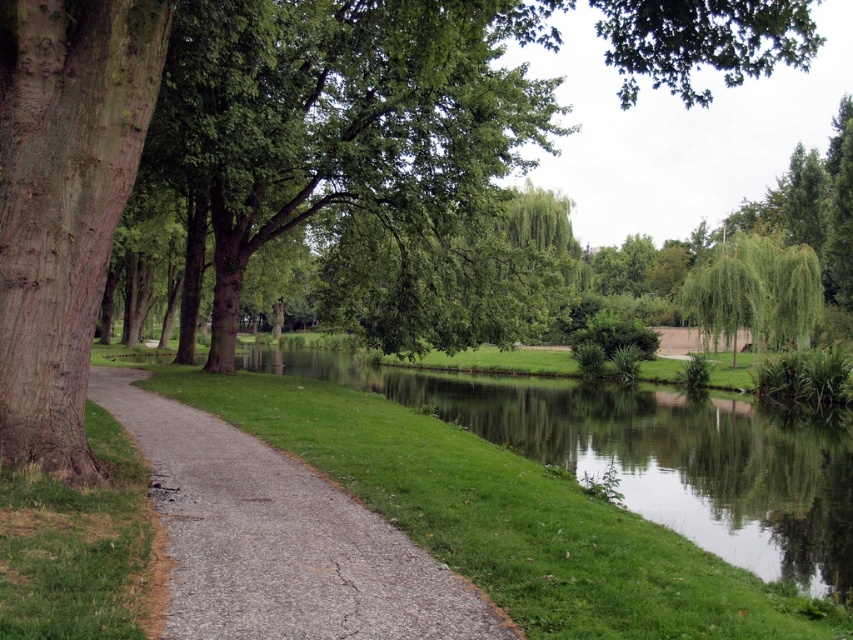
You are a gardener who needs to plant a new tree. You have a sapling that requires at least 10 feet of space between its base and the gray asphalt path at center to ensure proper growth. Based on the scene, can the smooth brown bark at left be a suitable location for planting the sapling?

The distance between the smooth brown bark at left and the gray asphalt path at center is 9.57 feet. Since the required space is 10 feet, the smooth brown bark at left does not provide enough space, so it is not a suitable location for planting the sapling.

You are standing at the point marked as point [64,200] in the park. What do you see around you?

You are standing at point [64,200], which is the location of the green leafy tree at left. The surrounding area includes a paved pathway running parallel to the water on the right side, lush greenery along the banks, and a tranquil body of water reflecting the sky and trees.